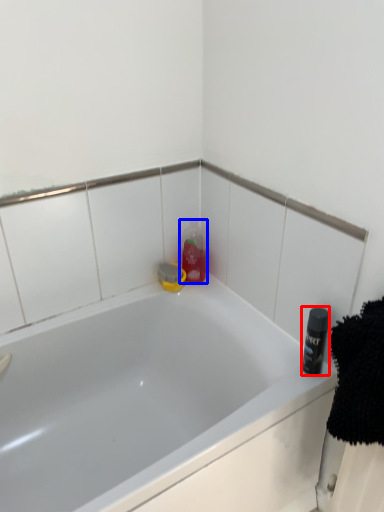
Question: Among these objects, which one is farthest to the camera, toiletry (highlighted by a red box) or cleaning product (highlighted by a blue box)?

Choices:
 (A) toiletry
 (B) cleaning product

Answer: (B)